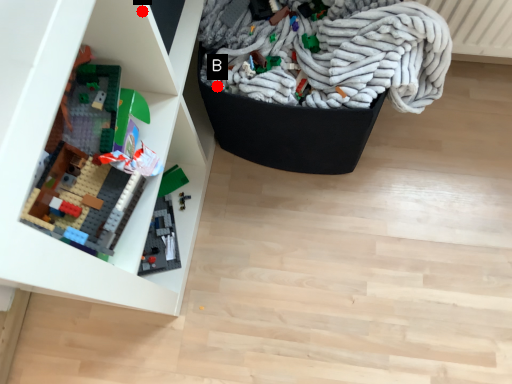
Question: Two points are circled on the image, labeled by A and B beside each circle. Which point is farther from the camera taking this photo?

Choices:
 (A) A is further
 (B) B is further

Answer: (B)